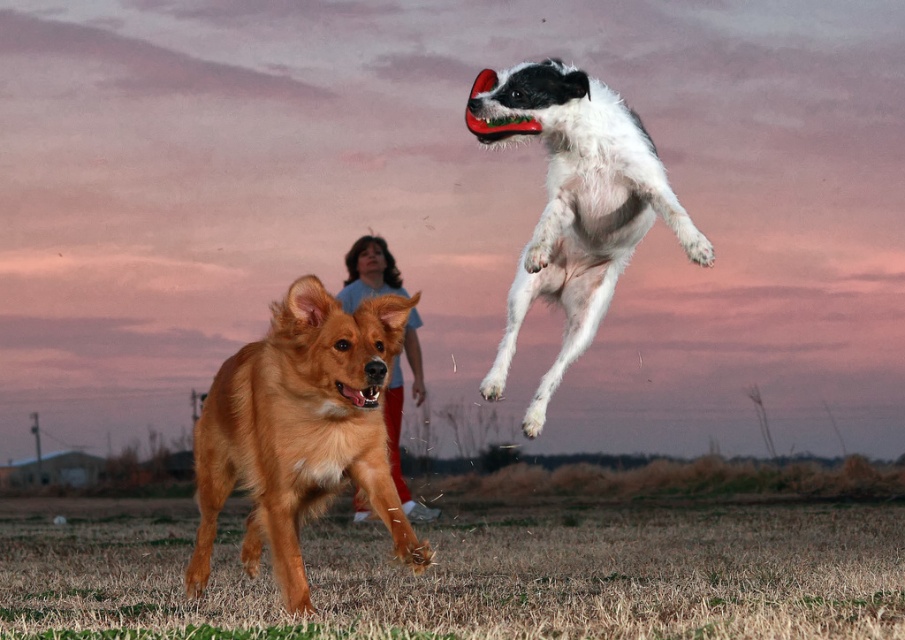
You are a photographer trying to capture a photo of both the golden fur dog at center and the white fur dog at upper right. Based on their positions, which dog would appear closer to the bottom of the photo?

The golden fur dog at center is located below the white fur dog at upper right, so it would appear closer to the bottom of the photo.

Where is the golden fur dog at center located in the image?

The golden fur dog at center is located at point 0.675 on the x axis and 0.333 on the y axis.